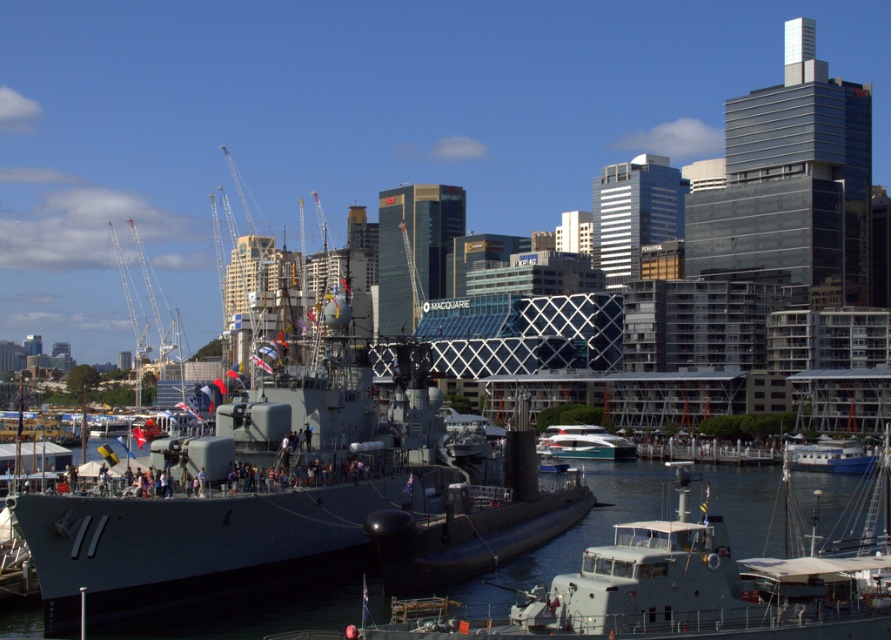
Can you confirm if metallic gray boat at center is wider than white glossy yacht at center?

Yes.

Is metallic gray boat at center closer to camera compared to white glossy yacht at center?

Yes, it is.

Who is more distant from viewer, (610, 547) or (625, 456)?

Point (625, 456)

The height and width of the screenshot is (640, 891). What are the coordinates of `metallic gray boat at center` in the screenshot? It's located at (667, 593).

Who is positioned more to the left, white glossy yacht at center or blue matte boat at lower right?

white glossy yacht at center

At what (x,y) coordinates should I click in order to perform the action: click on white glossy yacht at center. Please return your answer as a coordinate pair (x, y). The width and height of the screenshot is (891, 640). Looking at the image, I should click on (583, 442).

Does metallic gray boat at center have a lesser height compared to blue matte boat at lower right?

In fact, metallic gray boat at center may be taller than blue matte boat at lower right.

What do you see at coordinates (667, 593) in the screenshot? This screenshot has height=640, width=891. I see `metallic gray boat at center` at bounding box center [667, 593].

The width and height of the screenshot is (891, 640). Identify the location of metallic gray boat at center. (667, 593).